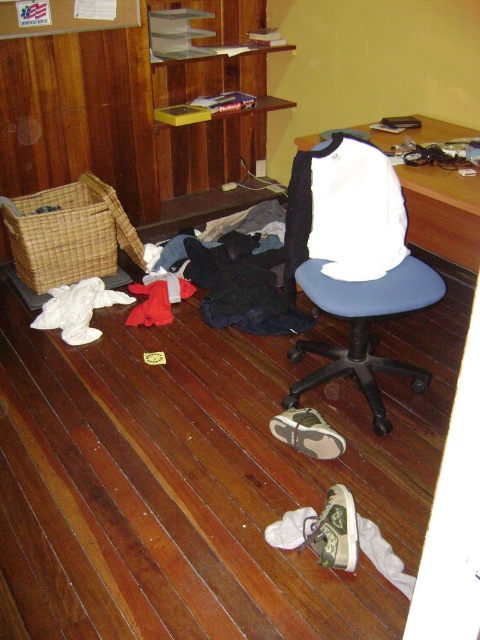
You need to reach the white canvas shoe at lower center that is under the wooden desk at center. Can you slide it out from under the desk without moving the desk?

The wooden desk at center is located above the white canvas shoe at lower center, so it is blocking access to the shoe. You may need to move the desk slightly to reach the shoe.

You are organizing a small party and need to place a 1.2 meter long tablecloth on the floor. You see the blue fabric swivel chair at center and the tan suede shoe at lower center. Which object will the tablecloth cover first if you start spreading it from the left side of the room?

The blue fabric swivel chair at center will be covered first because it is larger in size than the tan suede shoe at lower center, meaning it occupies more space and would be encountered sooner when spreading the tablecloth from the left.